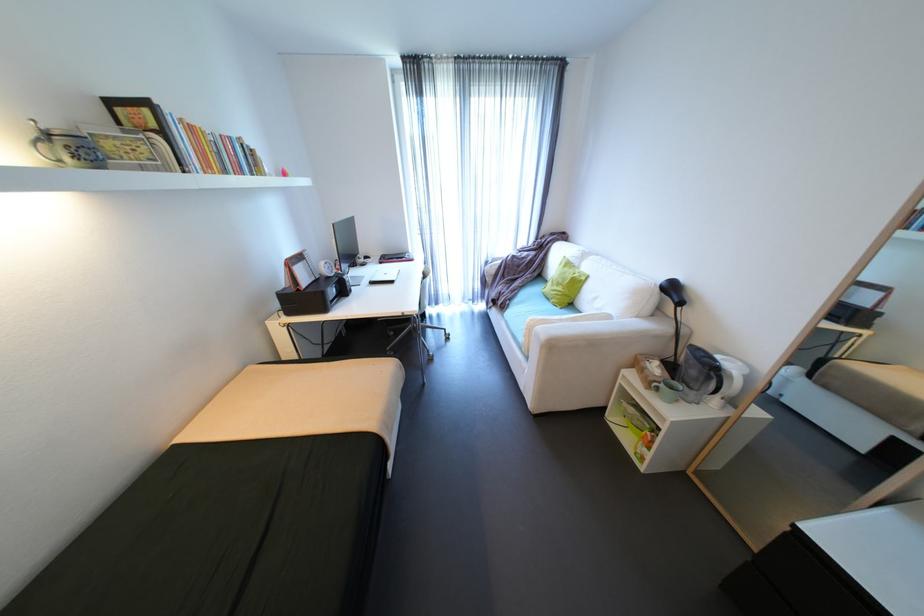
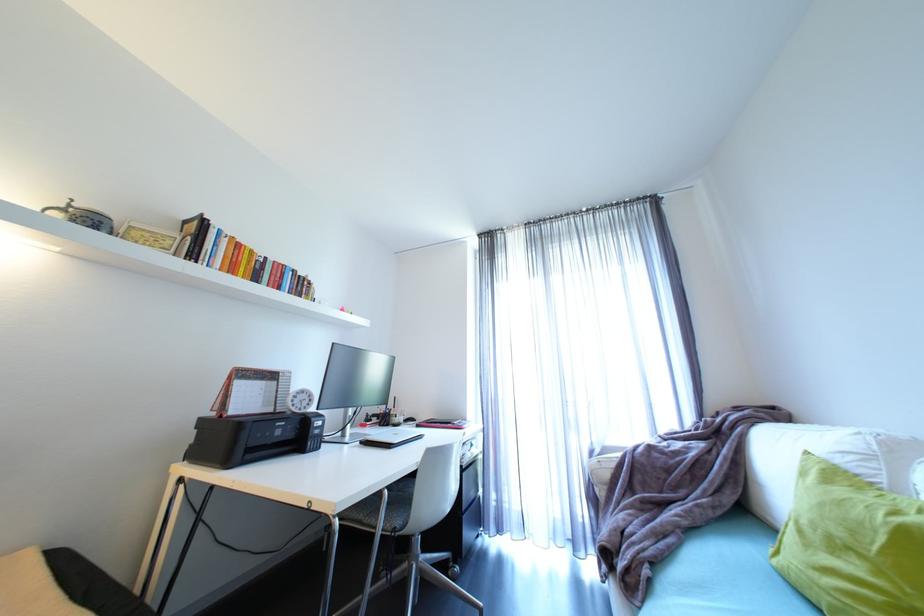
Locate, in the second image, the point that corresponds to point (398, 261) in the first image.

(440, 424)